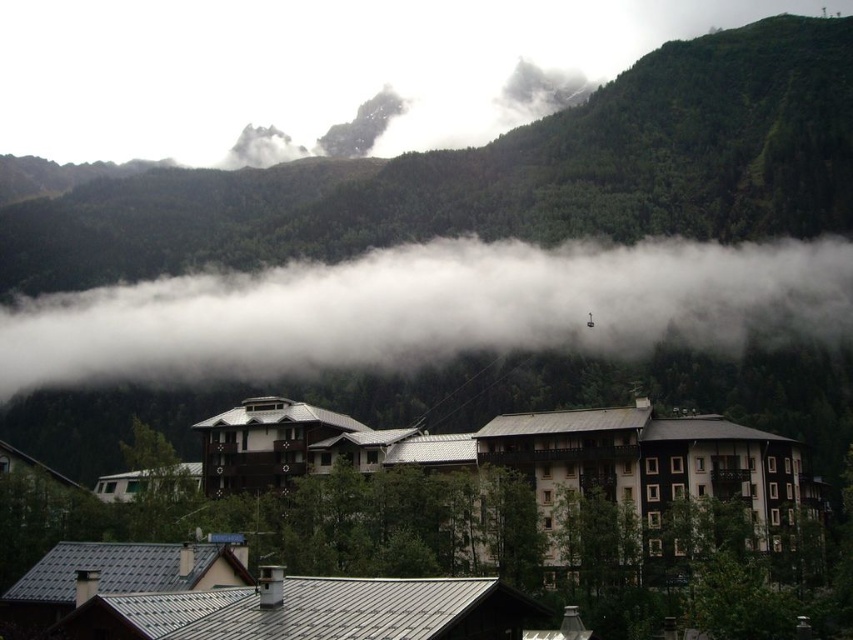
Question: Does brown wooden building at center lie in front of white fluffy cloud at upper center?

Choices:
 (A) yes
 (B) no

Answer: (A)

Question: Among these points, which one is farthest from the camera?

Choices:
 (A) (585, 532)
 (B) (444, 310)

Answer: (B)

Question: Is brown wooden building at center closer to the viewer compared to white fluffy cloud at upper center?

Choices:
 (A) yes
 (B) no

Answer: (A)

Question: Does brown wooden building at center have a lesser width compared to white fluffy cloud at upper center?

Choices:
 (A) yes
 (B) no

Answer: (A)